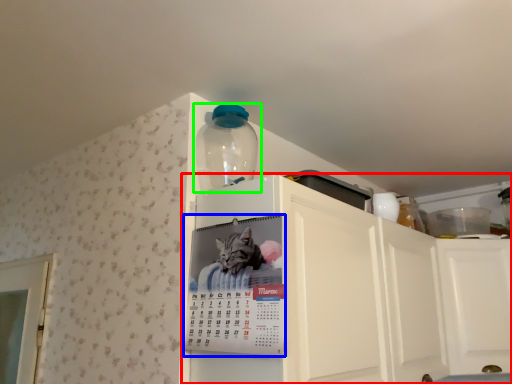
Question: Estimate the real-world distances between objects in this image. Which object is farther from cabinetry (highlighted by a red box), poster (highlighted by a blue box) or bottle (highlighted by a green box)?

Choices:
 (A) poster
 (B) bottle

Answer: (B)